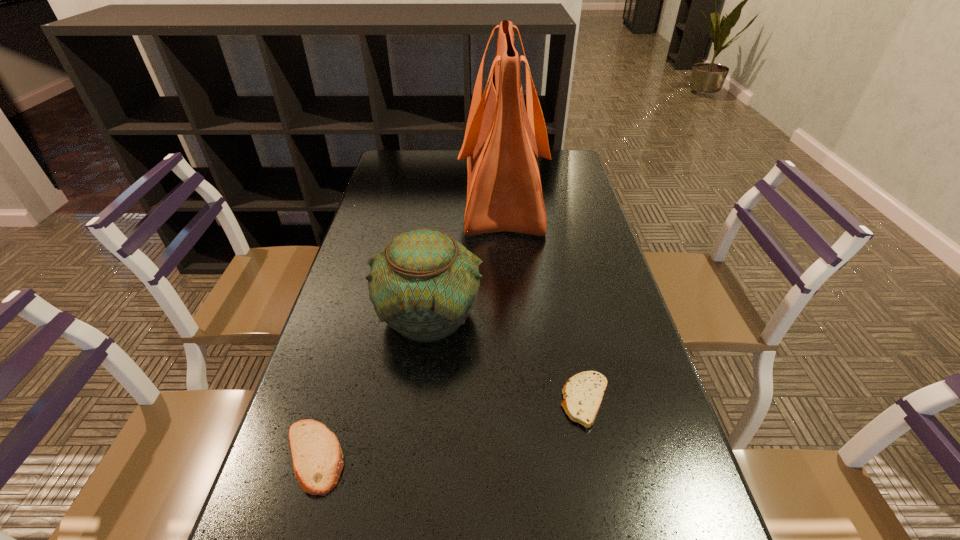
Find the location of `the tallest object`. the tallest object is located at coordinates (502, 141).

At what (x,y) coordinates should I click in order to perform the action: click on shopping bag. Please return your answer as a coordinate pair (x, y). This screenshot has width=960, height=540. Looking at the image, I should click on (502, 141).

Locate an element on the screen. the third nearest object is located at coordinates (424, 284).

Locate an element on the screen. The image size is (960, 540). the third shortest object is located at coordinates click(424, 284).

This screenshot has width=960, height=540. What are the coordinates of `the taller pita bread` in the screenshot? It's located at (317, 458).

This screenshot has height=540, width=960. What are the coordinates of `the third tallest object` in the screenshot? It's located at click(x=317, y=458).

Image resolution: width=960 pixels, height=540 pixels. In order to click on the right pita bread in this screenshot , I will do `click(583, 393)`.

You are a GUI agent. You are given a task and a screenshot of the screen. Output one action in this format:
    pyautogui.click(x=<x>, y=<y>)
    Task: Click on the shortest object
    The image size is (960, 540).
    Given the screenshot: What is the action you would take?
    pyautogui.click(x=583, y=393)

At what (x,y) coordinates should I click in order to perform the action: click on blank space located on the front pocket of the farthest object. Please return your answer as a coordinate pair (x, y). The height and width of the screenshot is (540, 960). Looking at the image, I should click on (387, 195).

At what (x,y) coordinates should I click in order to perform the action: click on free space located on the front pocket of the farthest object. Please return your answer as a coordinate pair (x, y). Image resolution: width=960 pixels, height=540 pixels. Looking at the image, I should click on (396, 195).